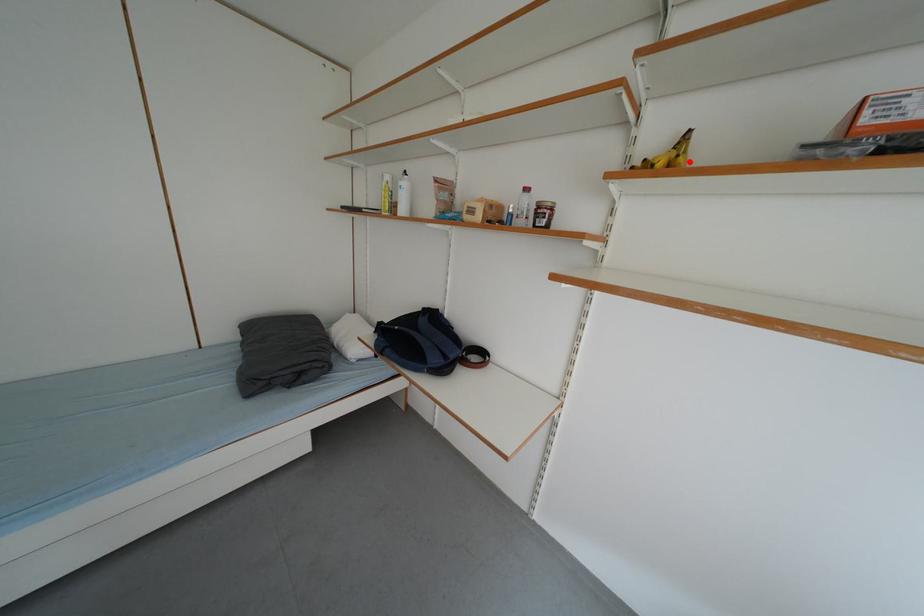
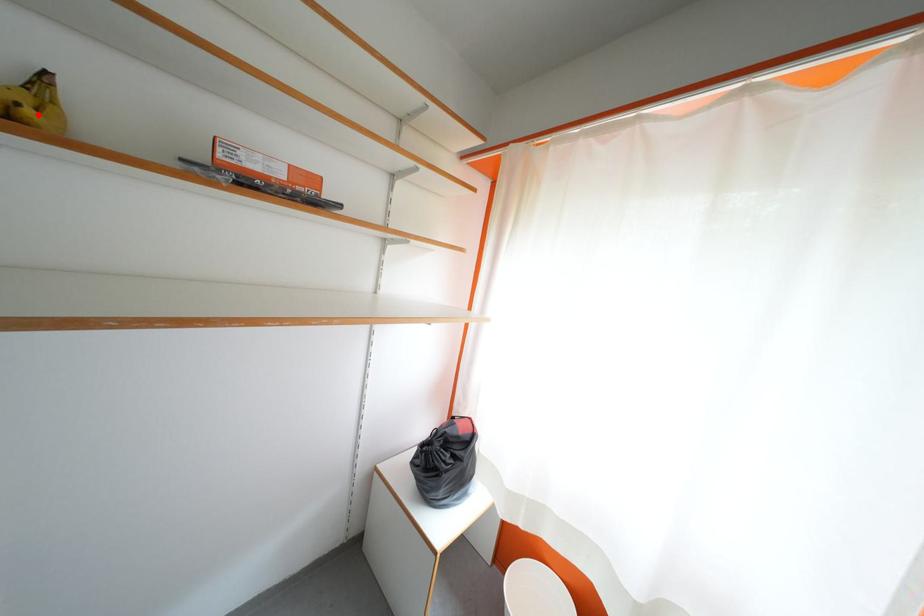
I am providing you with two images of the same scene from different viewpoints. A red point is marked on the first image and another point is marked on the second image. Does the point marked in image1 correspond to the same location as the one in image2?

Yes